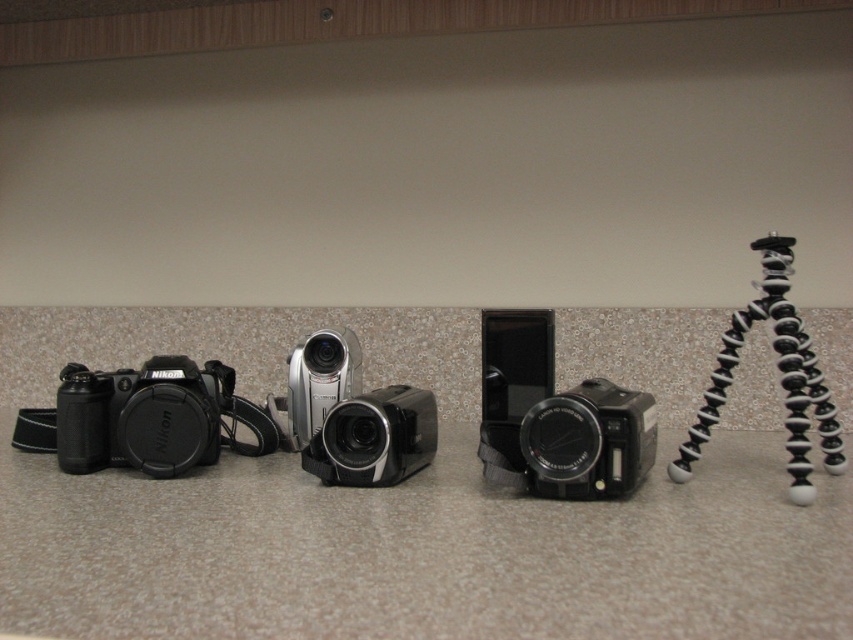
You are setting up equipment for a video shoot and need to place the black matte camera at left and the silver metallic camcorder at center on a shelf. The shelf has a width of 1.2 meters. Can both items fit side by side without overlapping?

The black matte camera at left might be wider than the silver metallic camcorder at center, so there is a possibility that they won

You are setting up equipment for a video shoot and need to position two markers on the countertop. The first marker is at point [155,356] and the second at point [299,378]. Based on their positions, which marker is closer to you when viewed from the front of the scene?

Point [155,356] is in front of point [299,378], so the first marker at point [155,356] is closer to you when viewed from the front of the scene.

You are standing in front of the countertop and want to pick up the black plastic camcorder at center. Is it within arm reach if your arm can extend 1 meter?

The black plastic camcorder at center is 1.15 meters from the viewer, so it is slightly out of arm reach since your arm can only extend 1 meter.